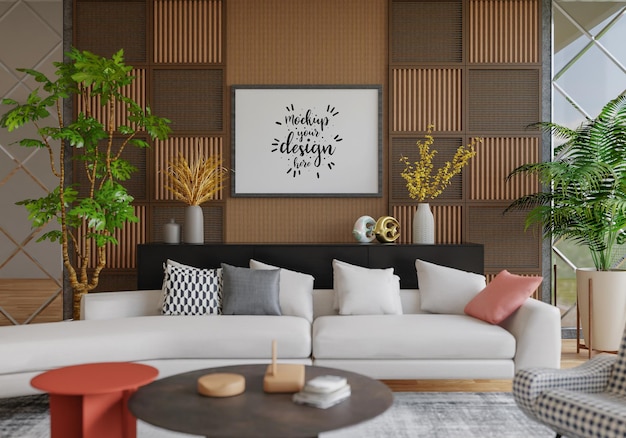
You are a GUI agent. You are given a task and a screenshot of the screen. Output one action in this format:
    pyautogui.click(x=<x>, y=<y>)
    Task: Click on the picture
    The image size is (626, 438).
    Given the screenshot: What is the action you would take?
    pyautogui.click(x=357, y=149)